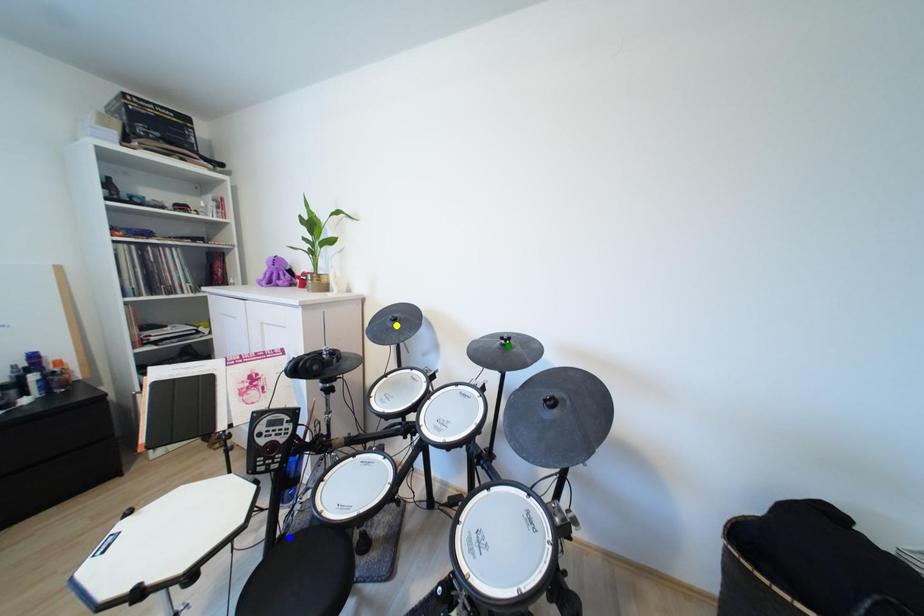
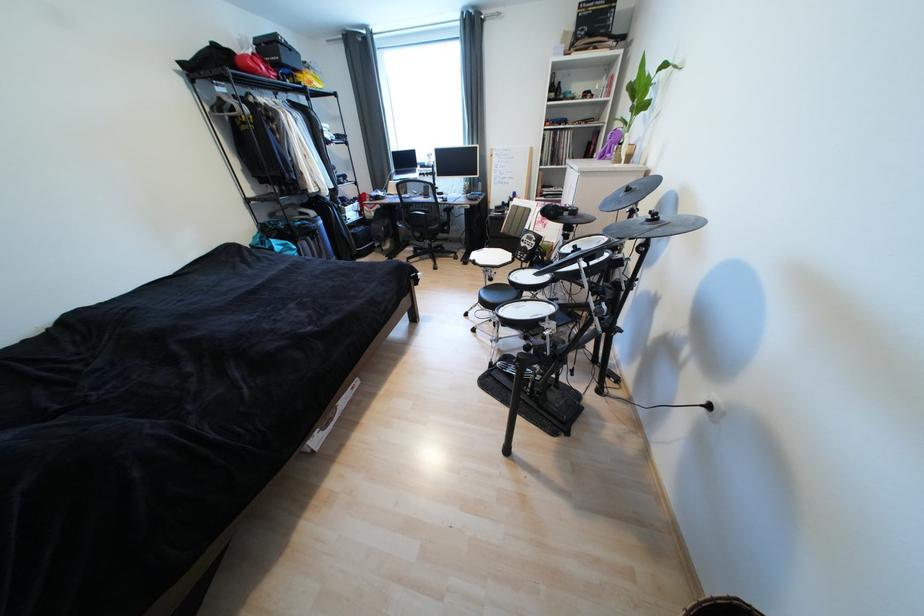
I am providing you with two images of the same scene from different viewpoints. Three points are marked in image1. Which point corresponds to a part or object that is occluded in image2?In image1, three points are marked. Which of them correspond to a part or object that is occluded in image2?Among the three points shown in image1, which one corresponds to a part or object that is no longer visible due to occlusion in image2?

blue point